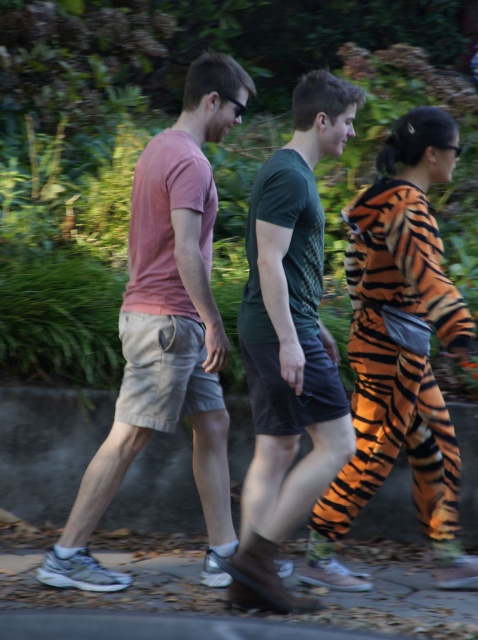
Question: Is orange tiger print onesie at center wider than brown stone pavement at lower center?

Choices:
 (A) no
 (B) yes

Answer: (A)

Question: Which of the following is the closest to the observer?

Choices:
 (A) (123, 579)
 (B) (389, 566)
 (C) (311, 256)

Answer: (C)

Question: In this image, where is orange tiger print onesie at center located relative to brown stone pavement at lower center?

Choices:
 (A) right
 (B) left

Answer: (A)

Question: Among these objects, which one is nearest to the camera?

Choices:
 (A) orange tiger print onesie at center
 (B) brown stone pavement at lower center

Answer: (B)

Question: Which object is closer to the camera taking this photo?

Choices:
 (A) brown stone pavement at lower center
 (B) matte pink t-shirt at center

Answer: (A)

Question: Does matte pink t-shirt at center appear on the left side of orange tiger print onesie at center?

Choices:
 (A) no
 (B) yes

Answer: (B)